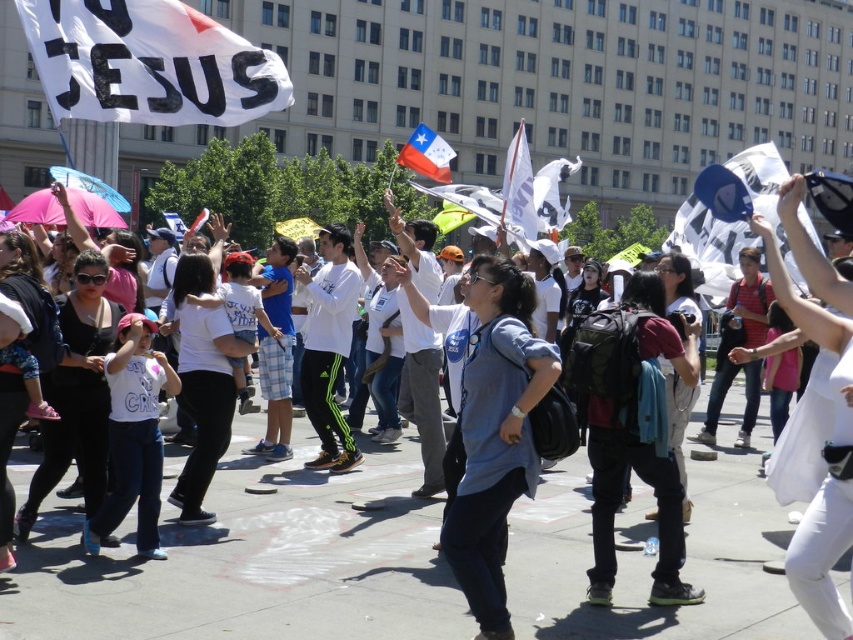
Is matte gray shirt at center behind white paper flag at upper right?

Yes, it is.

The height and width of the screenshot is (640, 853). I want to click on matte gray shirt at center, so click(254, 563).

Find the location of `matte gray shirt at center`. matte gray shirt at center is located at coordinates (254, 563).

Consider the image. Who is more distant from viewer, (397, 598) or (426, 157)?

Positioned behind is point (426, 157).

Which is in front, point (543, 540) or point (422, 150)?

Point (543, 540) is in front.

Measure the distance between point [222,592] and camera.

A distance of 7.64 meters exists between point [222,592] and camera.

The height and width of the screenshot is (640, 853). What are the coordinates of `matte gray shirt at center` in the screenshot? It's located at (254, 563).

Is point (107, 96) in front of point (407, 138)?

Yes.

Is white fabric flag at upper left taller than polished fabric chilean flag at upper center?

In fact, white fabric flag at upper left may be shorter than polished fabric chilean flag at upper center.

Measure the distance between white fabric flag at upper left and camera.

A distance of 8.73 meters exists between white fabric flag at upper left and camera.

Locate an element on the screen. white fabric flag at upper left is located at coordinates (148, 64).